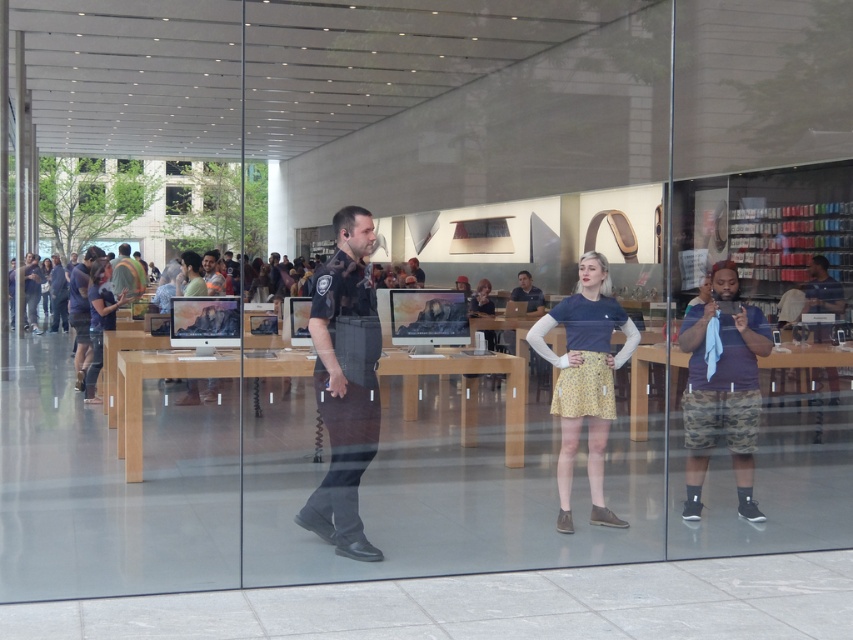
You are standing outside the Apple Store looking through the window. You see a point at coordinates (722, 387). What object is this point located on?

The point at coordinates (722, 387) is located on the camo shorts at right.

You are a customer who wants to ask about the iMac computers. You see the dark blue shirt at center. Which direction should you walk to reach the iMac computers?

The dark blue shirt at center is located at point (527, 292). Since the iMac computers are on the display tables inside the store, you should walk towards the store entrance from the dark blue shirt at center to reach them.